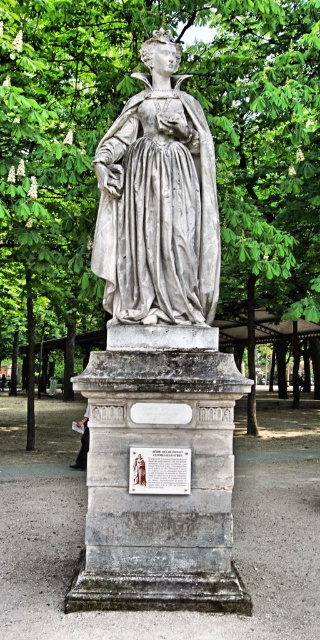
You are standing in a park and see the white marble statue at center. If you want to touch the statue, how many steps do you need to take forward? Assume each step covers 0.75 meters.

The white marble statue at center is 5.15 meters away. Dividing the distance by the step length of 0.75 meters gives approximately 6.87 steps. Since you can only take whole steps, you would need to take 7 steps forward to reach the statue.

You are a park maintenance worker checking the layout of the park. You need to place a new bench exactly 2 meters north of the white marble statue at center. Where should you place the bench?

The bench should be placed 2 meters north of the white marble statue at center at point (159,360).